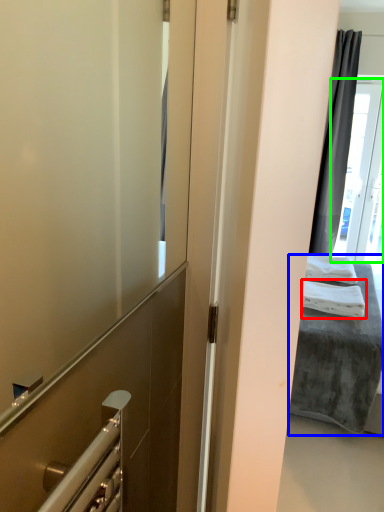
Question: Which is nearer to the bath towel (highlighted by a red box)? bed (highlighted by a blue box) or glass door (highlighted by a green box).

Choices:
 (A) bed
 (B) glass door

Answer: (A)